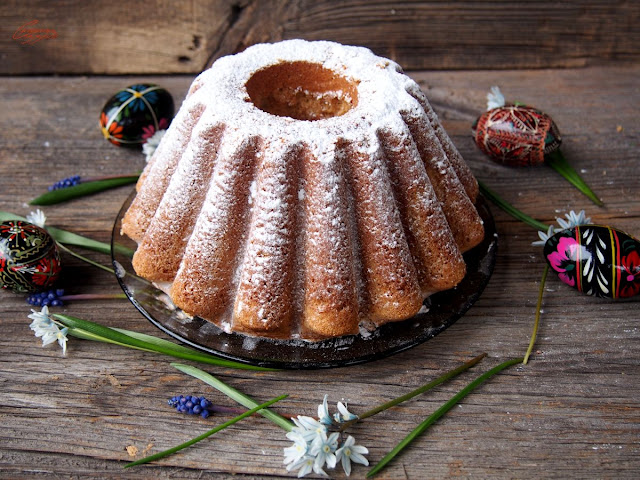
Locate an element on the screen. This screenshot has width=640, height=480. worn wooden table top is located at coordinates (573, 392).